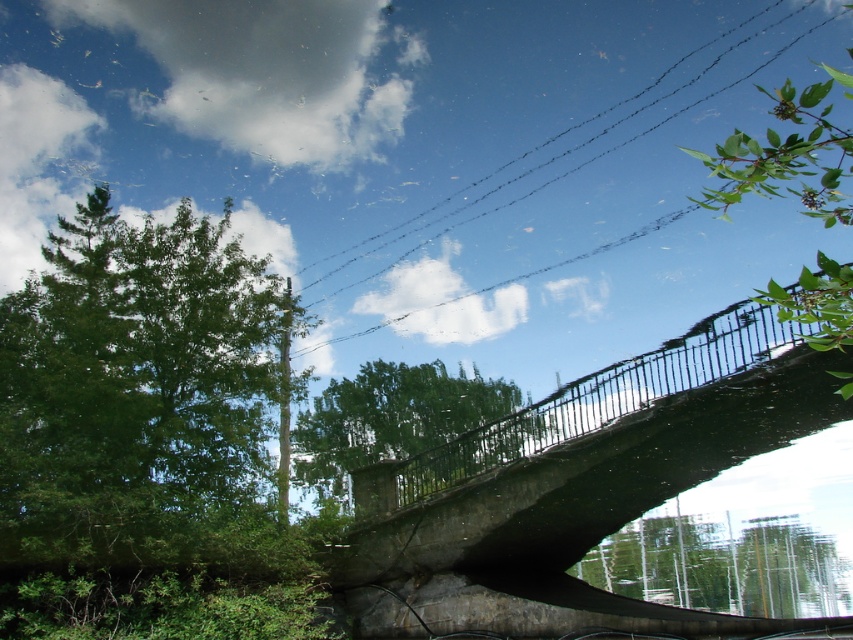
Question: Which point appears farthest from the camera in this image?

Choices:
 (A) (35, 464)
 (B) (612, 124)

Answer: (B)

Question: In this image, where is green leafy tree at left located relative to green leafy tree at center?

Choices:
 (A) above
 (B) below

Answer: (A)

Question: Which object appears closest to the camera in this image?

Choices:
 (A) green leafy tree at left
 (B) black wire at upper center
 (C) green leafy tree at upper right

Answer: (C)

Question: In this image, where is concrete bridge at center located relative to green leafy tree at left?

Choices:
 (A) left
 (B) right

Answer: (B)

Question: Does green leafy tree at upper right appear over black wire at upper center?

Choices:
 (A) yes
 (B) no

Answer: (B)

Question: Estimate the real-world distances between objects in this image. Which object is closer to the green leafy tree at left?

Choices:
 (A) black wire at upper center
 (B) green leafy tree at upper right

Answer: (A)